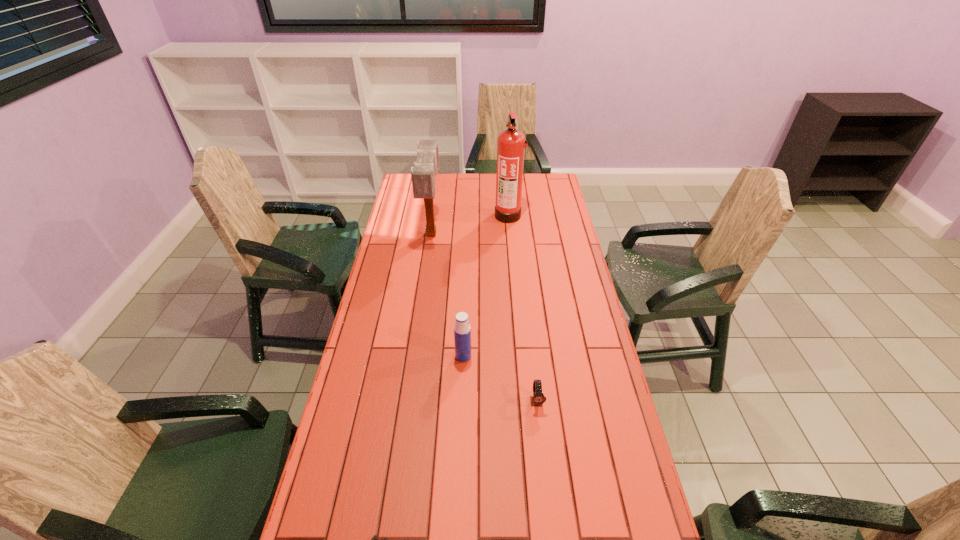
Locate an element on the screen. This screenshot has height=540, width=960. free space between the tallest object and the second tallest object is located at coordinates (470, 225).

Find the location of `free spot between the third object from right to left and the watch`. free spot between the third object from right to left and the watch is located at coordinates (500, 379).

At what (x,y) coordinates should I click in order to perform the action: click on empty space between the second tallest object and the tallest object. Please return your answer as a coordinate pair (x, y). This screenshot has height=540, width=960. Looking at the image, I should click on (470, 225).

Locate an element on the screen. vacant area between the second shortest object and the tallest object is located at coordinates (522, 308).

Find the location of a particular element. The image size is (960, 540). the closest object relative to the second tallest object is located at coordinates (511, 145).

Select which object appears as the second closest to the water bottle. Please provide its 2D coordinates. Your answer should be formatted as a tuple, i.e. [(x, y)], where the tuple contains the x and y coordinates of a point satisfying the conditions above.

[(374, 538)]